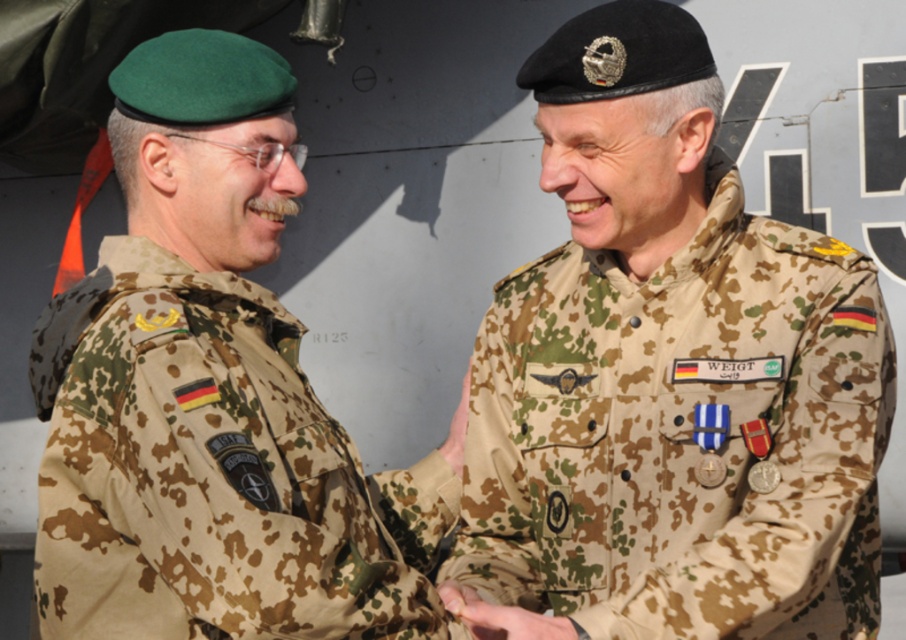
What does the point at coordinates [668,378] represent in the image?

The point at coordinates [668,378] indicates the camouflage uniform at center.

You are a photographer trying to capture a group photo of the camouflage uniform at center and the camouflage uniform at left. Since you want both to appear the same size in the photo, where should you position yourself relative to them?

To make the camouflage uniform at center and the camouflage uniform at left appear the same size in the photo, you should move closer to the camouflage uniform at left since it is smaller and position yourself equidistant from both, ensuring their sizes are balanced in the frame.